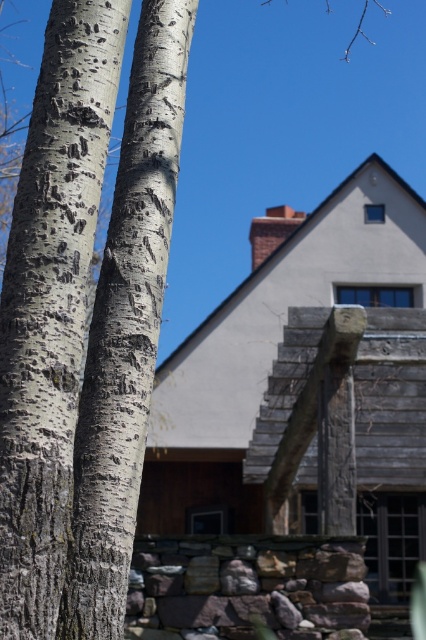
Question: Which point appears closest to the camera in this image?

Choices:
 (A) (141, 401)
 (B) (17, 460)

Answer: (B)

Question: Which point is closer to the camera?

Choices:
 (A) (3, 545)
 (B) (100, 285)

Answer: (A)

Question: Is white textured bark at left closer to the viewer compared to white bark tree trunk at left?

Choices:
 (A) yes
 (B) no

Answer: (A)

Question: Observing the image, what is the correct spatial positioning of white textured bark at left in reference to white bark tree trunk at left?

Choices:
 (A) right
 (B) left

Answer: (B)

Question: Can you confirm if white textured bark at left is thinner than white bark tree trunk at left?

Choices:
 (A) no
 (B) yes

Answer: (B)

Question: Among these objects, which one is farthest from the camera?

Choices:
 (A) white bark tree trunk at left
 (B) white textured bark at left

Answer: (A)